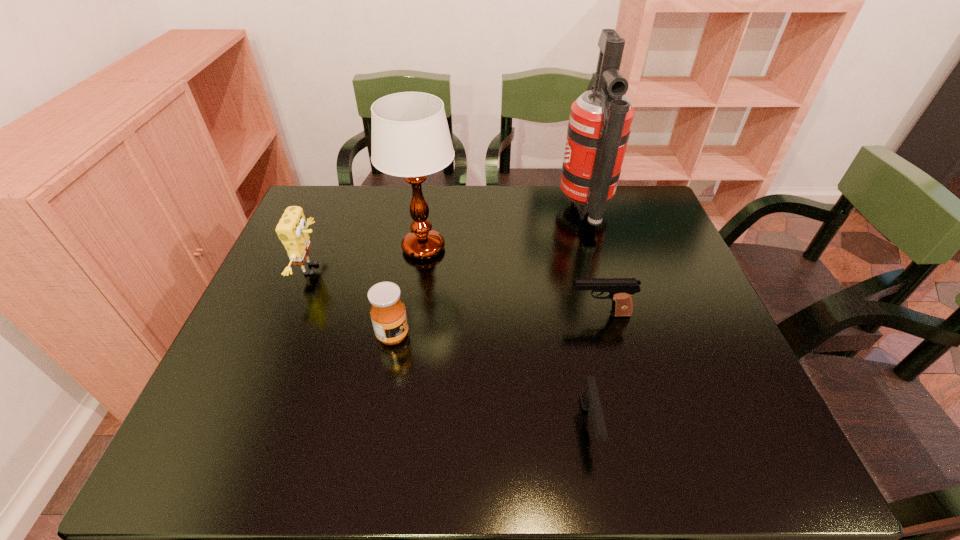
Locate an element on the screen. This screenshot has height=540, width=960. unoccupied position between the leftmost object and the fire extinguisher is located at coordinates pyautogui.click(x=448, y=239).

Where is `empty location between the fire extinguisher and the third nearest object`? empty location between the fire extinguisher and the third nearest object is located at coordinates (592, 262).

The image size is (960, 540). In order to click on unoccupied area between the fifth farthest object and the tallest object in this screenshot , I will do `click(489, 272)`.

Where is `vacant space that's between the leftmost object and the farther pistol`? The image size is (960, 540). vacant space that's between the leftmost object and the farther pistol is located at coordinates (456, 292).

Where is `vacant area between the leftmost object and the second tallest object`? The image size is (960, 540). vacant area between the leftmost object and the second tallest object is located at coordinates (368, 259).

The width and height of the screenshot is (960, 540). In order to click on free spot between the tallest object and the second nearest object in this screenshot , I will do `click(489, 272)`.

This screenshot has height=540, width=960. I want to click on free point between the third tallest object and the third nearest object, so click(x=456, y=292).

Locate an element on the screen. vacant space in between the fire extinguisher and the fourth shortest object is located at coordinates (448, 239).

The image size is (960, 540). Find the location of `unoccupied position between the fourth tallest object and the leftmost object`. unoccupied position between the fourth tallest object and the leftmost object is located at coordinates (352, 302).

This screenshot has height=540, width=960. Identify the location of object that stands as the second closest to the third shortest object. (292, 231).